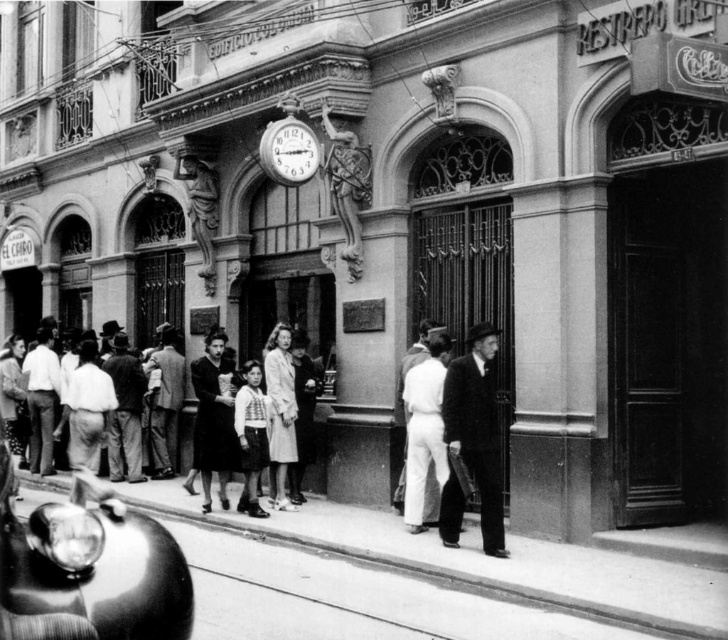
You are standing on the street in front of Edificio Colombo and see a dark fabric dress at center and a light brown fabric shirt at center. Which clothing item is closer to you?

The dark fabric dress at center is closer to you because it is further to the viewer than the light brown fabric shirt at center.